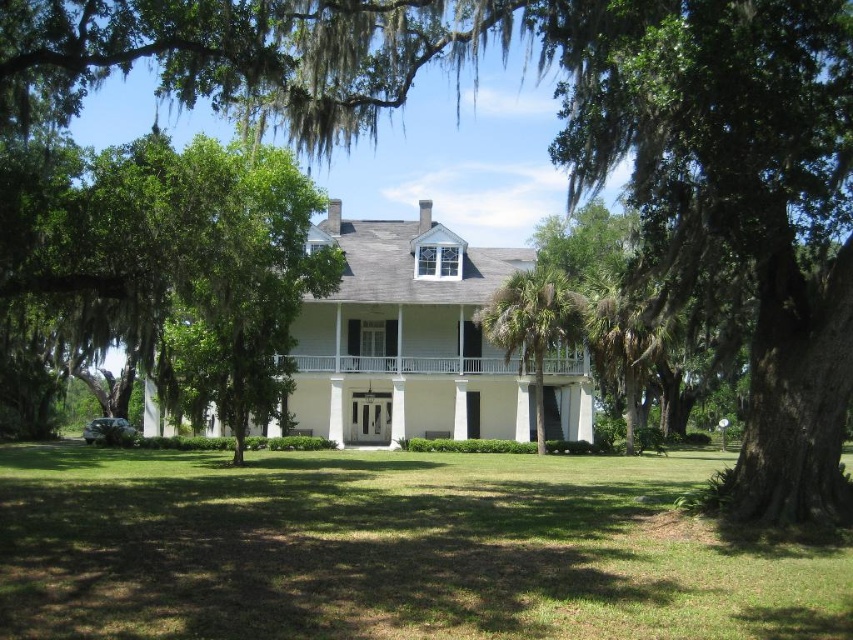
Is green grass at center to the left of green leafy palm tree at center from the viewer's perspective?

Yes, green grass at center is to the left of green leafy palm tree at center.

Is green grass at center taller than green leafy palm tree at center?

No, green grass at center is not taller than green leafy palm tree at center.

Is point (177, 467) closer to viewer compared to point (502, 349)?

Yes, it is.

This screenshot has width=853, height=640. What are the coordinates of `green grass at center` in the screenshot? It's located at (387, 550).

Between green grass at center and white wooden porch at center, which one has more height?

With more height is green grass at center.

Is point (715, 465) positioned before point (579, 371)?

Yes, it is.

Locate an element on the screen. This screenshot has width=853, height=640. green grass at center is located at coordinates (387, 550).

Which of these two, green leafy palm tree at center or white wooden porch at center, stands taller?

green leafy palm tree at center is taller.

Who is shorter, green leafy palm tree at center or white wooden porch at center?

white wooden porch at center

Is point (560, 275) positioned behind point (503, 369)?

No, it is in front of (503, 369).

You are a GUI agent. You are given a task and a screenshot of the screen. Output one action in this format:
    pyautogui.click(x=<x>, y=<y>)
    Task: Click on the green leafy palm tree at center
    
    Given the screenshot: What is the action you would take?
    pyautogui.click(x=532, y=324)